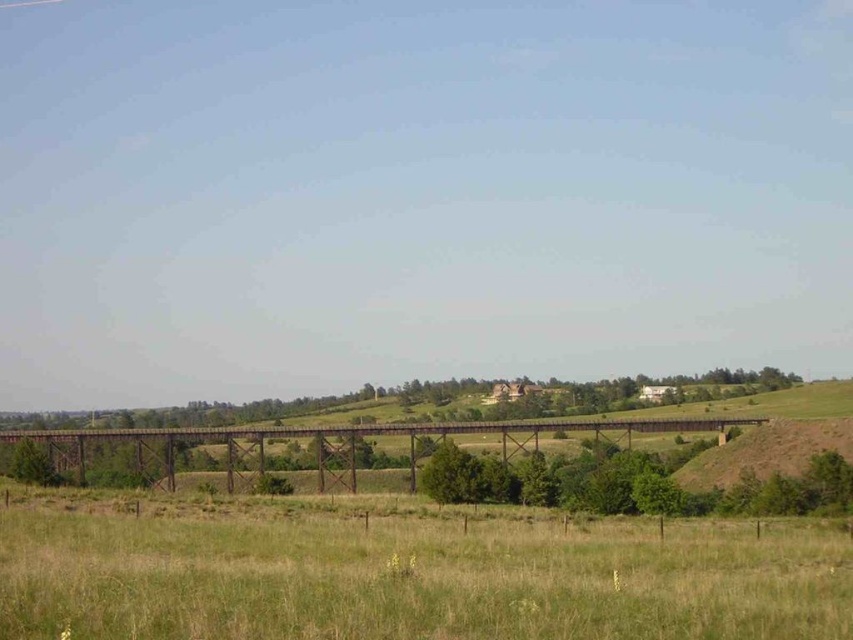
Question: Is green grassy field at lower center behind rusty metal bridge at center?

Choices:
 (A) yes
 (B) no

Answer: (B)

Question: Can you confirm if green grassy field at lower center is smaller than rusty metal bridge at center?

Choices:
 (A) no
 (B) yes

Answer: (B)

Question: Which object is farther from the camera taking this photo?

Choices:
 (A) rusty metal bridge at center
 (B) green grassy field at lower center

Answer: (A)

Question: Which point is farther to the camera?

Choices:
 (A) (190, 632)
 (B) (196, 435)

Answer: (B)

Question: Observing the image, what is the correct spatial positioning of green grassy field at lower center in reference to rusty metal bridge at center?

Choices:
 (A) below
 (B) above

Answer: (B)